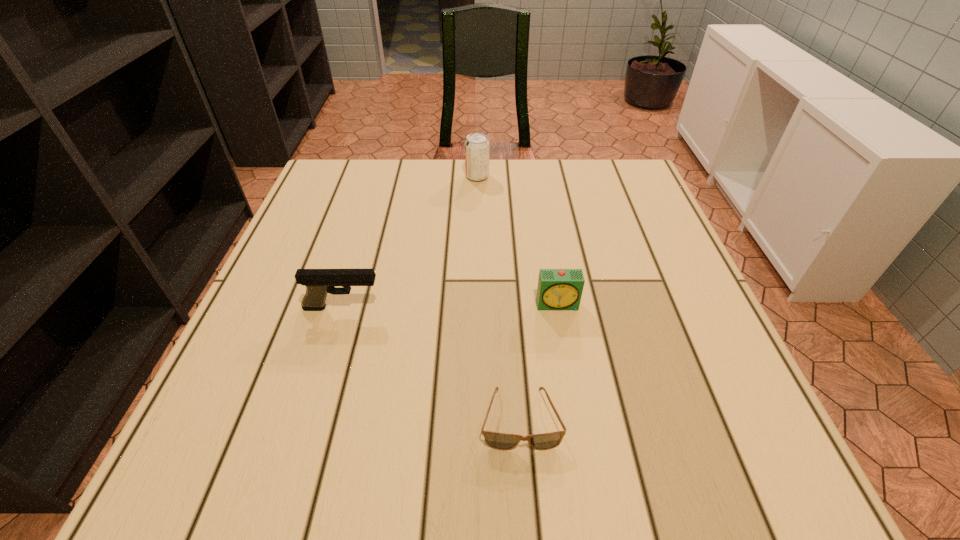
This screenshot has height=540, width=960. I want to click on object at the left edge, so click(x=319, y=282).

Where is `vacant space at the far edge`? This screenshot has width=960, height=540. vacant space at the far edge is located at coordinates (455, 191).

In the image, there is a desktop. What are the coordinates of `free region at the near edge` in the screenshot? It's located at (494, 432).

Image resolution: width=960 pixels, height=540 pixels. Identify the location of free location at the left edge. (307, 330).

You are a GUI agent. You are given a task and a screenshot of the screen. Output one action in this format:
    pyautogui.click(x=<x>, y=<y>)
    Task: Click on the free space at the right edge
    This screenshot has height=540, width=960.
    Given the screenshot: What is the action you would take?
    coord(706,321)

This screenshot has width=960, height=540. In order to click on free space at the far left corner in this screenshot , I will do `click(343, 184)`.

Locate an element on the screen. This screenshot has width=960, height=540. vacant area at the far right corner of the desktop is located at coordinates (592, 205).

The width and height of the screenshot is (960, 540). Identify the location of vacant space that is in between the alarm clock and the pistol. (450, 306).

What are the coordinates of `free space between the pistol and the second shortest object` in the screenshot? It's located at (450, 306).

Where is `empty space that is in between the alarm clock and the leftmost object`? Image resolution: width=960 pixels, height=540 pixels. empty space that is in between the alarm clock and the leftmost object is located at coordinates (450, 306).